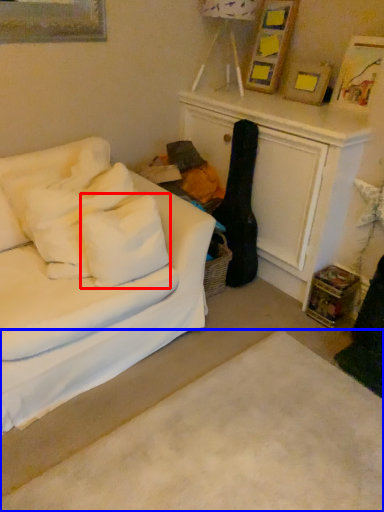
Question: Which object is closer to the camera taking this photo, pillow (highlighted by a red box) or plain (highlighted by a blue box)?

Choices:
 (A) pillow
 (B) plain

Answer: (B)